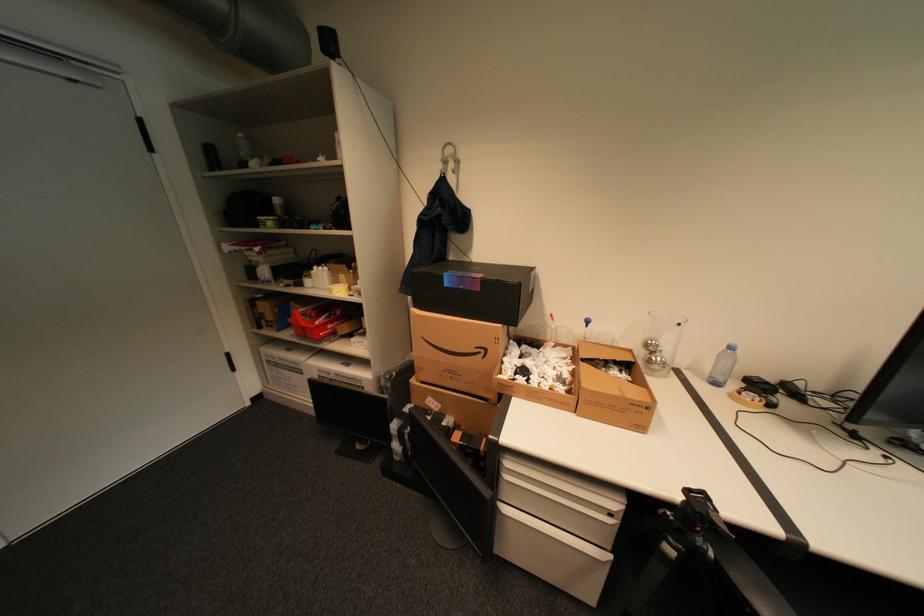
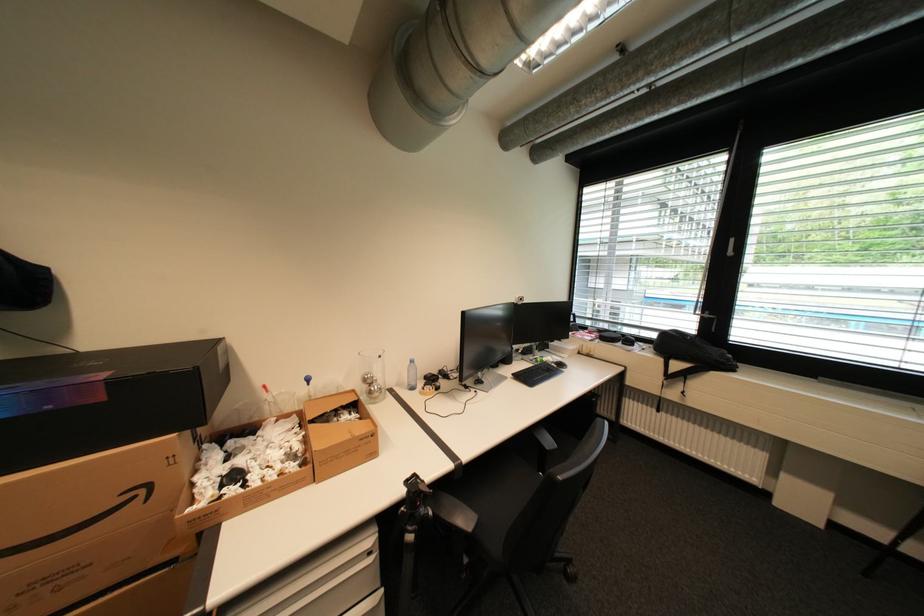
Locate, in the second image, the point that corresponds to (660,344) in the first image.

(377, 378)